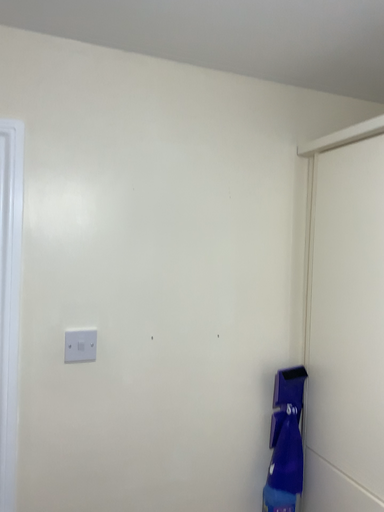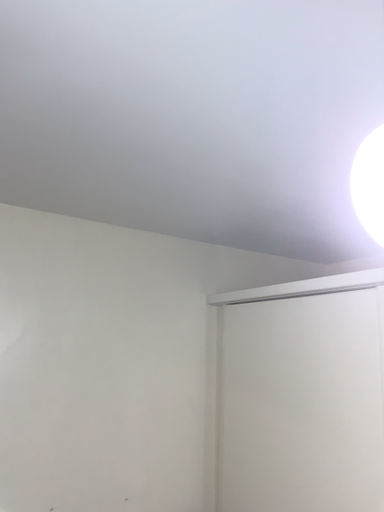
Question: How did the camera likely rotate when shooting the video?

Choices:
 (A) rotated left
 (B) rotated right

Answer: (B)